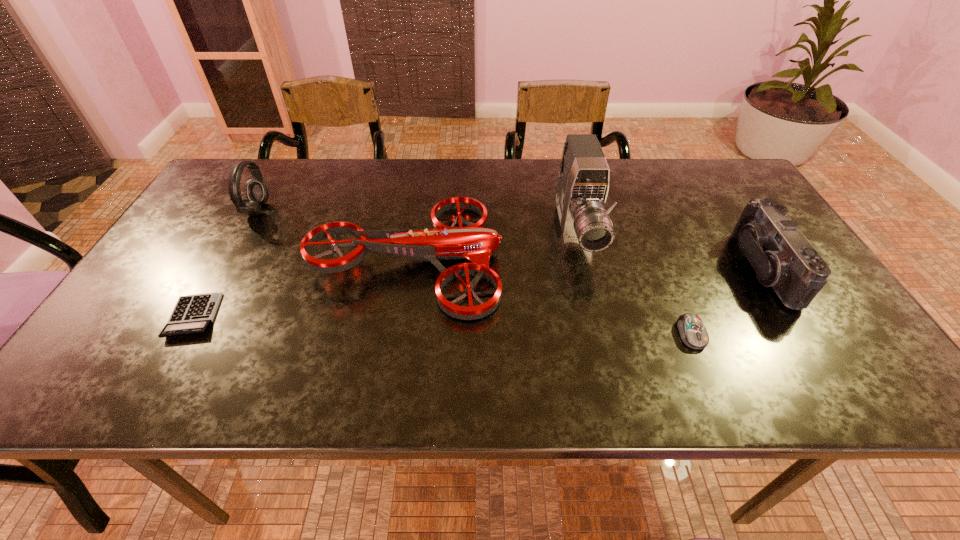
The image size is (960, 540). In order to click on the tallest object in this screenshot , I will do `click(583, 177)`.

I want to click on the left camcorder, so click(583, 177).

The image size is (960, 540). I want to click on headset, so click(257, 191).

The image size is (960, 540). What are the coordinates of `the right camcorder` in the screenshot? It's located at (782, 257).

Where is `the shorter camcorder`? The width and height of the screenshot is (960, 540). the shorter camcorder is located at coordinates (782, 257).

The image size is (960, 540). Identify the location of the fourth object from right to left. (475, 242).

At what (x,y) coordinates should I click in order to perform the action: click on drone. Please return your answer as a coordinate pair (x, y). Looking at the image, I should click on (475, 242).

Where is `the second object from right to left`? This screenshot has height=540, width=960. the second object from right to left is located at coordinates (692, 331).

Locate an element on the screen. The height and width of the screenshot is (540, 960). the fifth tallest object is located at coordinates (692, 331).

I want to click on the shortest object, so click(193, 314).